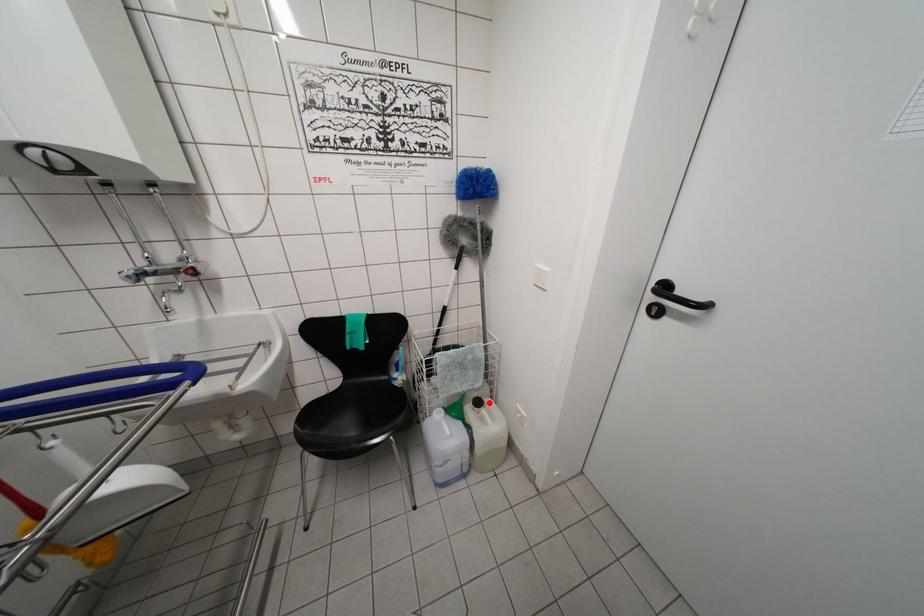
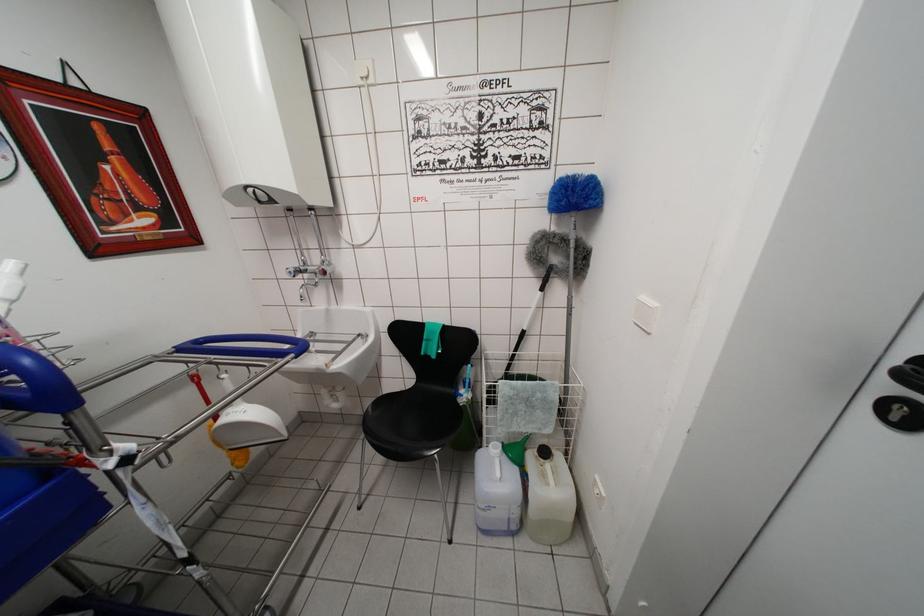
The point at the highlighted location is marked in the first image. Where is the corresponding point in the second image?

(561, 455)